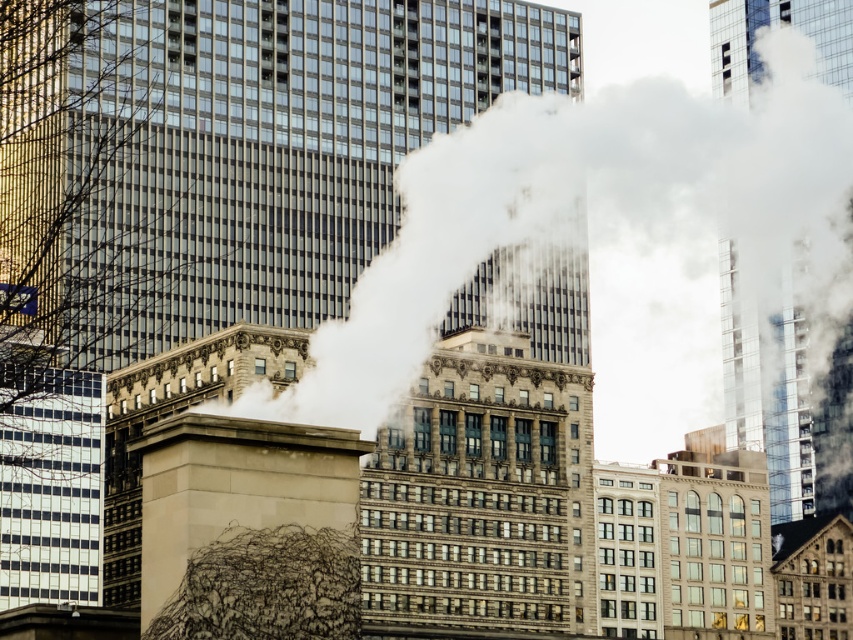
Question: Is white smoke at center bigger than beige stone chimney at center?

Choices:
 (A) no
 (B) yes

Answer: (B)

Question: Can you confirm if white smoke at center is positioned below beige stone chimney at center?

Choices:
 (A) no
 (B) yes

Answer: (A)

Question: Which point appears closest to the camera in this image?

Choices:
 (A) (183, 465)
 (B) (827, 184)

Answer: (A)

Question: Is white smoke at center behind beige stone chimney at center?

Choices:
 (A) yes
 (B) no

Answer: (A)